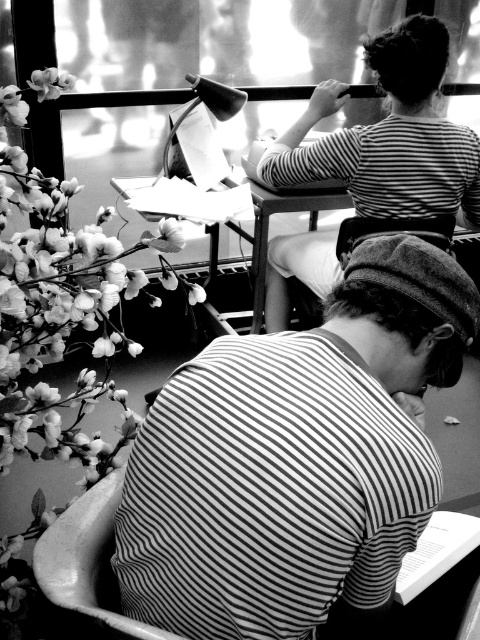
You are an interior designer observing this black and white image of a serene indoor scene. You notice the striped fabric shirt at lower center and the fluffy white flowers at left. Which object occupies more vertical space in the image?

The fluffy white flowers at left occupy more vertical space than the striped fabric shirt at lower center because the striped fabric shirt at lower center has a lesser height compared to fluffy white flowers at left.

You are standing in the room and want to place a small vase between the two people. The coordinates of the point where the vase should be placed are given as point (295, 458). According to the scene description, where exactly is this point located?

The point (295, 458) marks the location of the striped fabric shirt at lower center.

From the picture: You are a photographer adjusting your camera settings to focus on the fluffy white flowers at left and the striped shirt at upper center. Which object should you focus on first to ensure both are in sharp focus?

You should focus on the fluffy white flowers at left first because it is closer to the viewer than the striped shirt at upper center. By focusing on the closer object, the background object will also be in focus due to the depth of field.